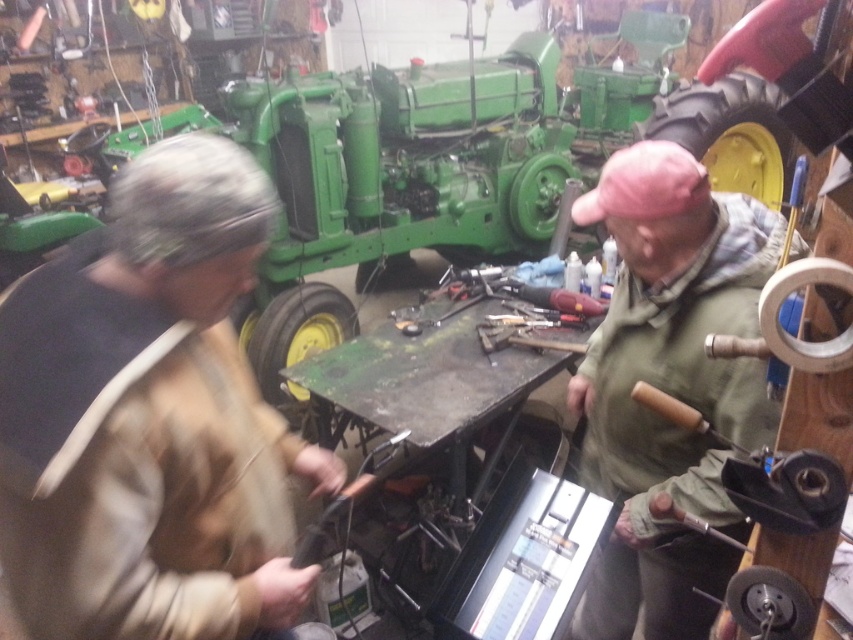
Question: Is camouflage fabric jacket at left wider than green fabric jacket at upper right?

Choices:
 (A) no
 (B) yes

Answer: (A)

Question: Which point is closer to the camera taking this photo?

Choices:
 (A) (140, 576)
 (B) (595, 604)

Answer: (A)

Question: Does camouflage fabric jacket at left have a greater width compared to green fabric jacket at upper right?

Choices:
 (A) yes
 (B) no

Answer: (B)

Question: Which point appears farthest from the camera in this image?

Choices:
 (A) (215, 497)
 (B) (599, 637)

Answer: (B)

Question: Is camouflage fabric jacket at left thinner than green fabric jacket at upper right?

Choices:
 (A) yes
 (B) no

Answer: (A)